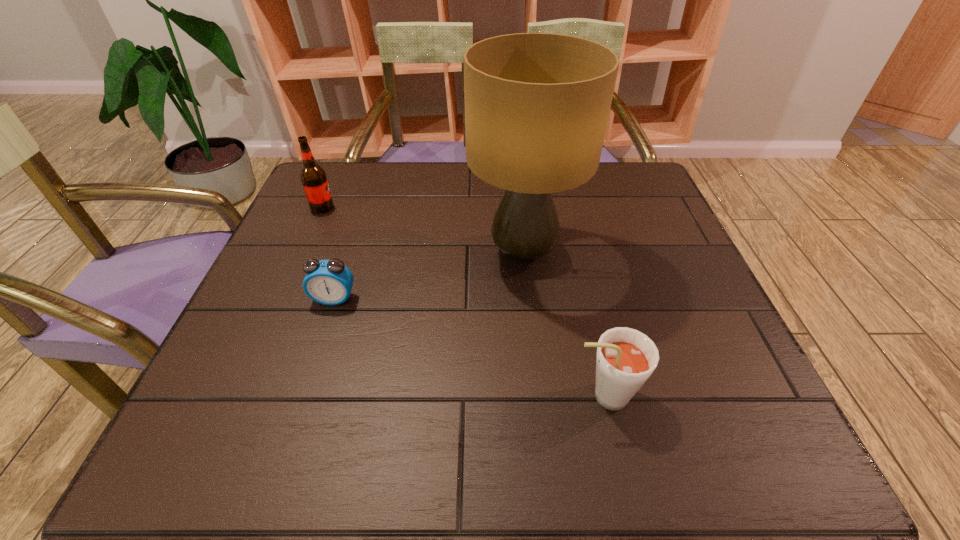
Find the location of a particular element. This screenshot has height=540, width=960. vacant space that is in between the second tallest object and the nearest object is located at coordinates (463, 302).

Where is `free area in between the lampshade and the right root beer`? Image resolution: width=960 pixels, height=540 pixels. free area in between the lampshade and the right root beer is located at coordinates (564, 324).

Identify the location of unoccupied area between the left root beer and the shorter root beer. (463, 302).

Where is `object that is the third nearest to the third object from right to left`? Image resolution: width=960 pixels, height=540 pixels. object that is the third nearest to the third object from right to left is located at coordinates (625, 359).

Select which object appears as the closest to the farther root beer. Please provide its 2D coordinates. Your answer should be formatted as a tuple, i.e. [(x, y)], where the tuple contains the x and y coordinates of a point satisfying the conditions above.

[(329, 282)]